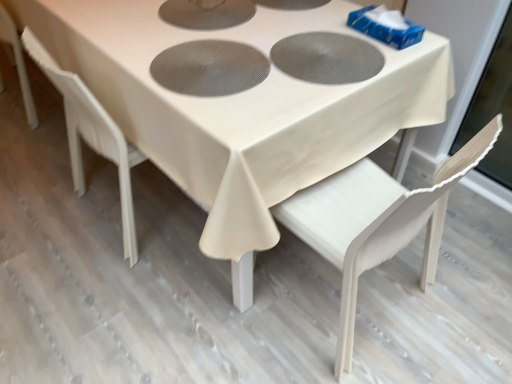
Question: Is white fabric table at center smaller than white matte chair at lower right, acting as the second chair starting from the left?

Choices:
 (A) no
 (B) yes

Answer: (A)

Question: Does white fabric table at center come in front of white matte chair at lower right, the 1th chair from the right?

Choices:
 (A) no
 (B) yes

Answer: (A)

Question: From the image's perspective, would you say white fabric table at center is positioned over white matte chair at lower right, the 1th chair from the right?

Choices:
 (A) no
 (B) yes

Answer: (B)

Question: Is white fabric table at center looking in the opposite direction of white matte chair at lower right, the 1th chair from the right?

Choices:
 (A) no
 (B) yes

Answer: (A)

Question: From the image's perspective, is white fabric table at center beneath white matte chair at lower right, acting as the second chair starting from the left?

Choices:
 (A) yes
 (B) no

Answer: (B)

Question: Does white fabric table at center have a greater width compared to white matte chair at lower right, the 1th chair from the right?

Choices:
 (A) no
 (B) yes

Answer: (B)

Question: Does white matte chair at lower right, acting as the second chair starting from the left, appear on the right side of white plastic chair at lower left, arranged as the 2th chair when viewed from the right?

Choices:
 (A) yes
 (B) no

Answer: (A)

Question: Is white matte chair at lower right, acting as the second chair starting from the left, smaller than white plastic chair at lower left, arranged as the 2th chair when viewed from the right?

Choices:
 (A) yes
 (B) no

Answer: (A)

Question: Is white matte chair at lower right, acting as the second chair starting from the left, outside of white plastic chair at lower left, acting as the first chair starting from the left?

Choices:
 (A) yes
 (B) no

Answer: (A)

Question: From a real-world perspective, does white matte chair at lower right, acting as the second chair starting from the left, stand above white plastic chair at lower left, acting as the first chair starting from the left?

Choices:
 (A) no
 (B) yes

Answer: (B)

Question: Is white matte chair at lower right, acting as the second chair starting from the left, shorter than white plastic chair at lower left, arranged as the 2th chair when viewed from the right?

Choices:
 (A) yes
 (B) no

Answer: (A)

Question: Are white matte chair at lower right, the 1th chair from the right, and white plastic chair at lower left, arranged as the 2th chair when viewed from the right, making contact?

Choices:
 (A) yes
 (B) no

Answer: (B)

Question: Is white plastic chair at lower left, acting as the first chair starting from the left, at the left side of white fabric table at center?

Choices:
 (A) no
 (B) yes

Answer: (A)